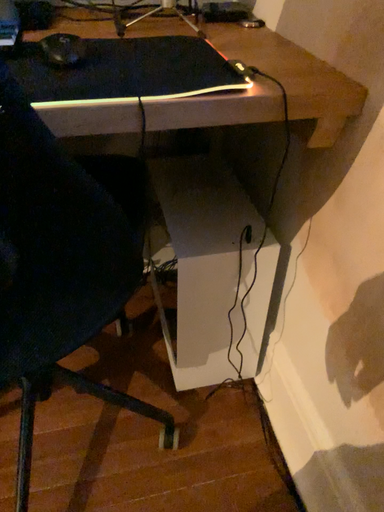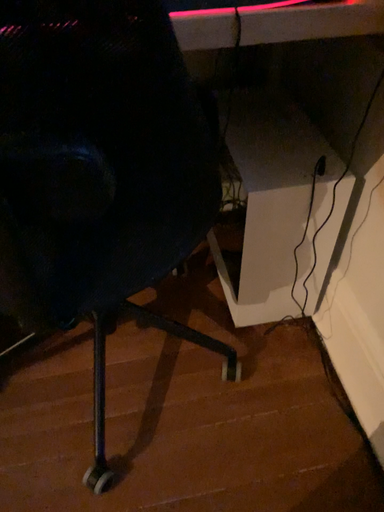
Question: Which way did the camera rotate in the video?

Choices:
 (A) rotated downward
 (B) rotated upward

Answer: (A)